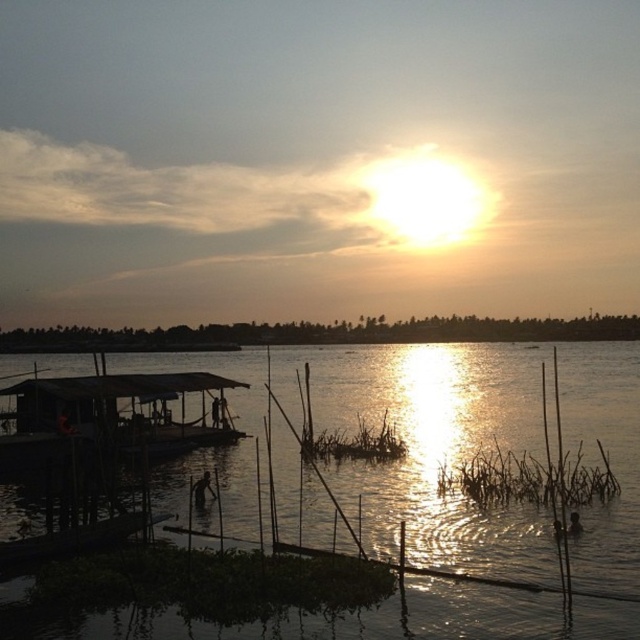
You are standing at the edge of the water in the sunset scene. There is a point labeled as point [433,445]. What is located at that point?

The point [433,445] corresponds to translucent water at center.

You are a photographer trying to capture the reflection of the sunset on the water. You notice the translucent water at center and the wooden boat at left. Which object should you focus on to best capture the sunset reflection?

The translucent water at center is positioned under the wooden boat at left, so focusing on the translucent water at center would allow you to capture the sunset reflection as it is the water surface.